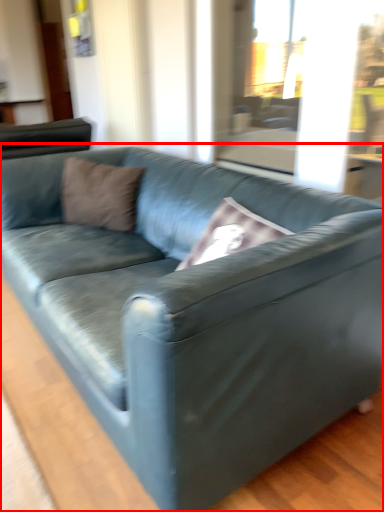
Question: Considering the relative positions of studio couch (annotated by the red box) and pillow in the image provided, where is studio couch (annotated by the red box) located with respect to the staircase?

Choices:
 (A) left
 (B) right

Answer: (B)